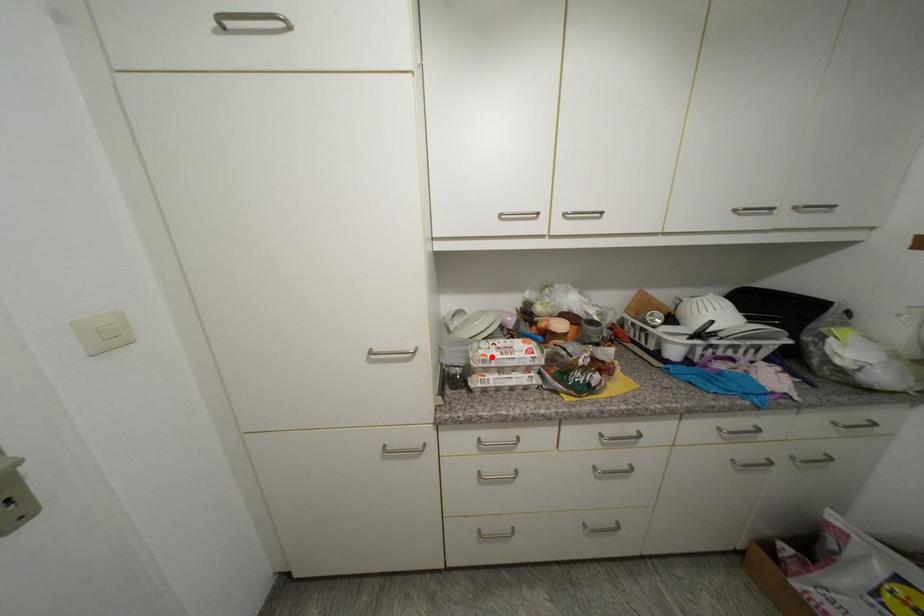
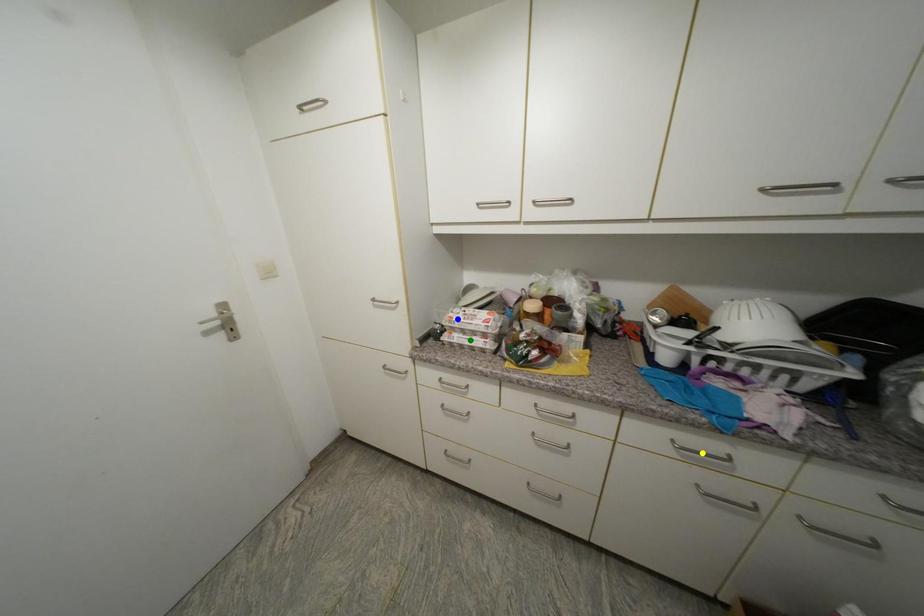
Question: I am providing you with two images of the same scene from different viewpoints. A red point is marked on the first image. You are given multiple points on the second image. Which point in image 2 represents the same 3d spot as the red point in image 1?

Choices:
 (A) green point
 (B) yellow point
 (C) blue point

Answer: (C)